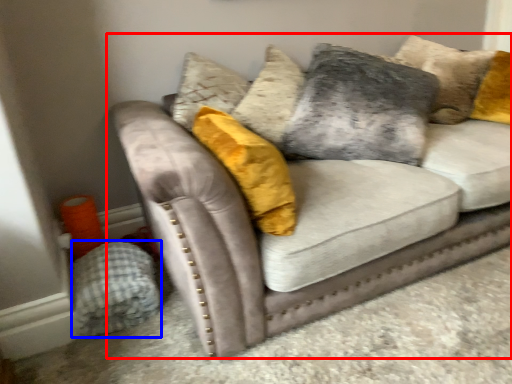
Question: Among these objects, which one is farthest to the camera, studio couch (highlighted by a red box) or material (highlighted by a blue box)?

Choices:
 (A) studio couch
 (B) material

Answer: (B)